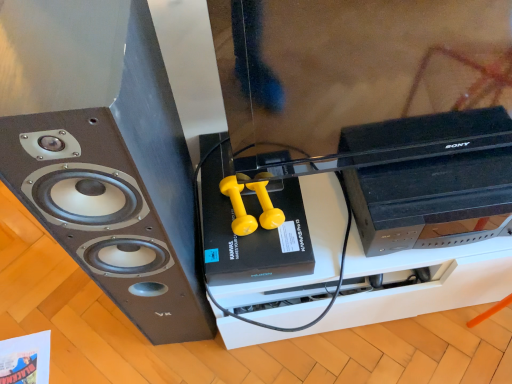
What are the coordinates of `black plastic computer at right` in the screenshot? It's located at (431, 196).

What do you see at coordinates (431, 196) in the screenshot? The height and width of the screenshot is (384, 512). I see `black plastic computer at right` at bounding box center [431, 196].

The height and width of the screenshot is (384, 512). What do you see at coordinates (104, 155) in the screenshot?
I see `black matte speaker at left` at bounding box center [104, 155].

The image size is (512, 384). I want to click on black matte speaker at left, so click(x=104, y=155).

You are a GUI agent. You are given a task and a screenshot of the screen. Output one action in this format:
    pyautogui.click(x=<x>, y=<y>)
    Task: Click on the black plastic computer at right
    
    Given the screenshot: What is the action you would take?
    pyautogui.click(x=431, y=196)

Would you say black plastic computer at right is to the left or to the right of black matte speaker at left in the picture?

black plastic computer at right is positioned on black matte speaker at left's right side.

In the image, is black plastic computer at right positioned in front of or behind black matte speaker at left?

Clearly, black plastic computer at right is behind black matte speaker at left.

Which is behind, point (486, 194) or point (37, 17)?

Positioned behind is point (486, 194).

From the image's perspective, does black plastic computer at right appear lower than black matte speaker at left?

No, from the image's perspective, black plastic computer at right is not below black matte speaker at left.

From a real-world perspective, is black plastic computer at right physically below black matte speaker at left?

Yes, from a real-world perspective, black plastic computer at right is beneath black matte speaker at left.

From the picture: Does black plastic computer at right have a greater width compared to black matte speaker at left?

In fact, black plastic computer at right might be narrower than black matte speaker at left.

Considering the relative sizes of black plastic computer at right and black matte speaker at left in the image provided, is black plastic computer at right taller than black matte speaker at left?

Incorrect, the height of black plastic computer at right is not larger of that of black matte speaker at left.

Is black plastic computer at right bigger than black matte speaker at left?

No.

Can we say black plastic computer at right lies outside black matte speaker at left?

Yes, black plastic computer at right is outside of black matte speaker at left.

Is black plastic computer at right positioned far away from black matte speaker at left?

Actually, black plastic computer at right and black matte speaker at left are a little close together.

In the scene shown: Is black plastic computer at right oriented towards black matte speaker at left?

No, black plastic computer at right does not turn towards black matte speaker at left.

How different are the orientations of black plastic computer at right and black matte speaker at left in degrees?

They differ by 3.45 degrees in their facing directions.

How far apart are black plastic computer at right and black matte speaker at left?

black plastic computer at right is 20.98 inches away from black matte speaker at left.

Locate an element on the screen. The image size is (512, 384). home appliance above the black plastic computer at right (from a real-world perspective) is located at coordinates (104, 155).

Is black matte speaker at left at the right side of black plastic computer at right?

No, black matte speaker at left is not to the right of black plastic computer at right.

Which object is further away from the camera, black matte speaker at left or black plastic computer at right?

black plastic computer at right is behind.

Which is behind, point (186, 246) or point (448, 158)?

The point (186, 246) is farther from the camera.

From the image's perspective, is black matte speaker at left above black plastic computer at right?

Actually, black matte speaker at left appears below black plastic computer at right in the image.

From a real-world perspective, is black matte speaker at left above or below black plastic computer at right?

black matte speaker at left is above black plastic computer at right.

Between black matte speaker at left and black plastic computer at right, which one has smaller width?

With smaller width is black plastic computer at right.

Does black matte speaker at left have a greater height compared to black plastic computer at right?

Indeed, black matte speaker at left has a greater height compared to black plastic computer at right.

Can you confirm if black matte speaker at left is bigger than black plastic computer at right?

Yes.

Would you say black matte speaker at left contains black plastic computer at right?

No, black matte speaker at left does not contain black plastic computer at right.

Is the surface of black matte speaker at left in direct contact with black plastic computer at right?

No, black matte speaker at left is not in contact with black plastic computer at right.

Could you tell me if black matte speaker at left is turned towards black plastic computer at right?

No, black matte speaker at left is not facing towards black plastic computer at right.

In the image, there is a black matte speaker at left. Find the location of `computer above it (from the image's perspective)`. computer above it (from the image's perspective) is located at coordinates (431, 196).

Identify the location of home appliance lying on the left of black plastic computer at right. The width and height of the screenshot is (512, 384). (104, 155).

At what (x,y) coordinates should I click in order to perform the action: click on computer below the black matte speaker at left (from a real-world perspective). Please return your answer as a coordinate pair (x, y). The height and width of the screenshot is (384, 512). Looking at the image, I should click on (431, 196).